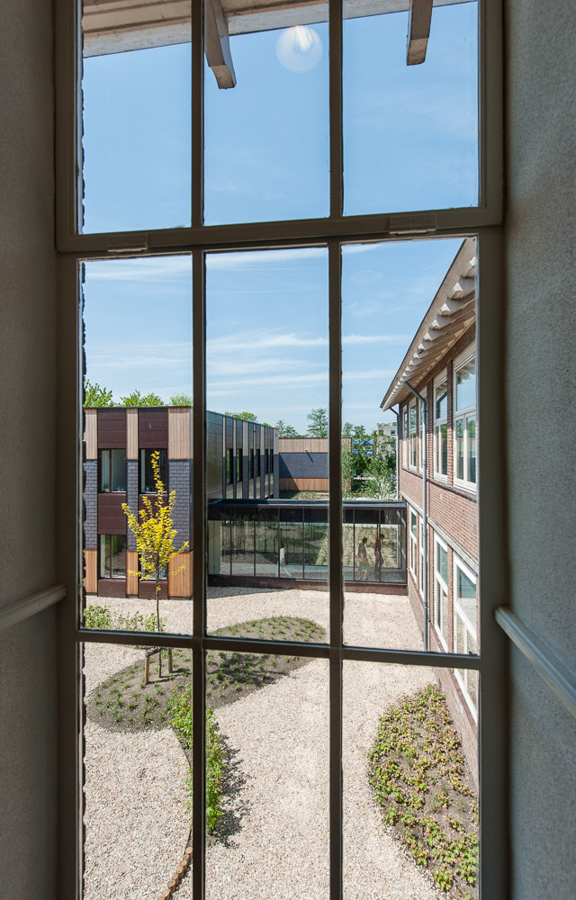
Find the location of `gray walls`. gray walls is located at coordinates (556, 814).